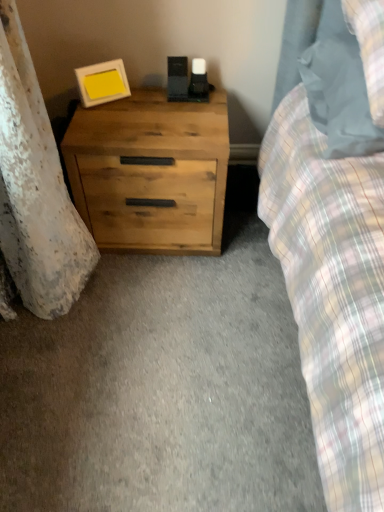
Where is `vacant region in front of matte white picture frame at upper left`? vacant region in front of matte white picture frame at upper left is located at coordinates (112, 121).